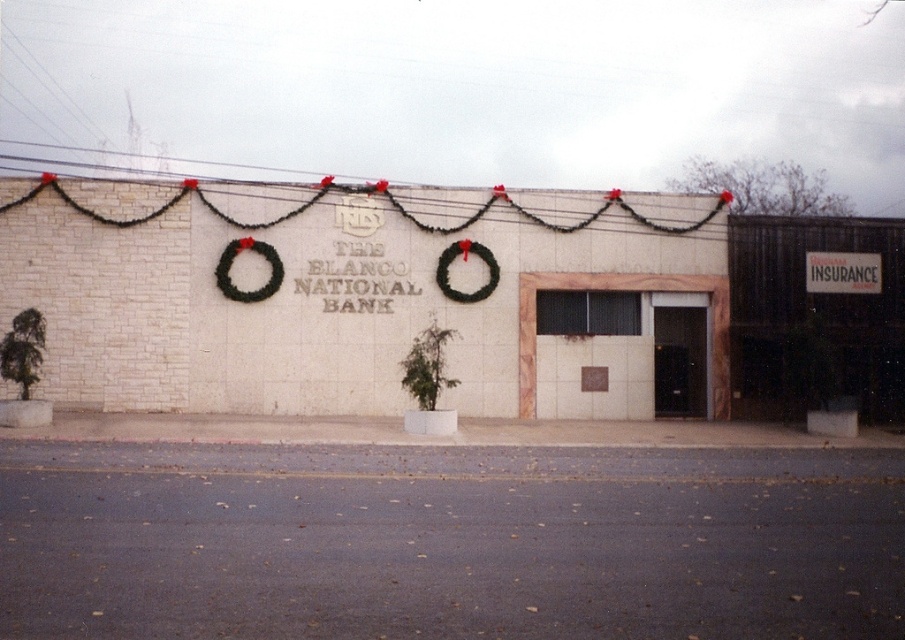
You are a window cleaner standing on the ground in front of The Blanco National Bank. You need to clean both the green leafy wreath at upper center and the green leafy wreath at center. Which wreath will require you to climb higher to reach?

The green leafy wreath at upper center is located higher up on the building than the green leafy wreath at center, so you will need to climb higher to reach it.

You are a window cleaner standing on a platform that can only move vertically. You need to clean both the green leafy wreath at upper center and the green leafy wreath at center. Which one should you clean first to avoid having to move the platform again?

You should clean the green leafy wreath at center first because the green leafy wreath at upper center is positioned under it. By starting with the higher one, you can then lower the platform to reach the one below without needing to reposition.